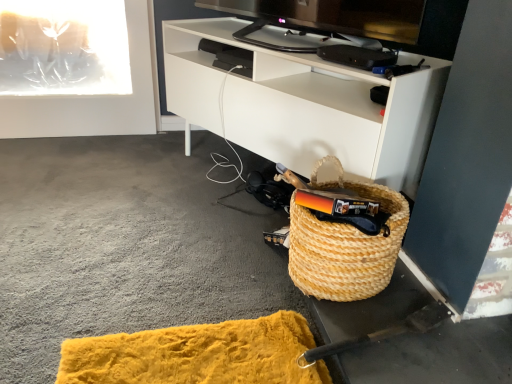
Where is `vacant point to the left of natural woven basket at lower right`? vacant point to the left of natural woven basket at lower right is located at coordinates (232, 289).